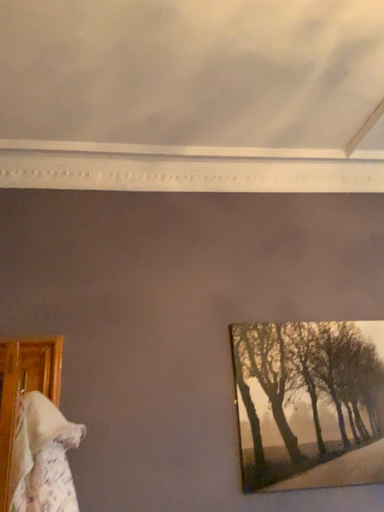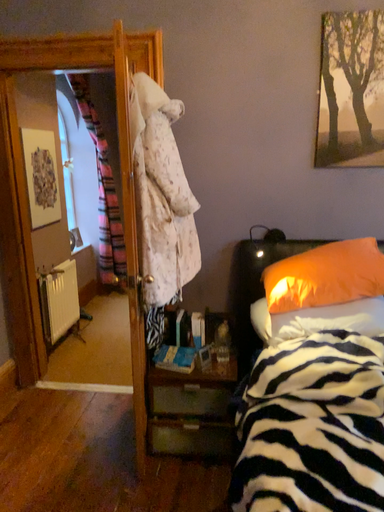
Question: Which way did the camera rotate in the video?

Choices:
 (A) rotated upward
 (B) rotated downward

Answer: (B)